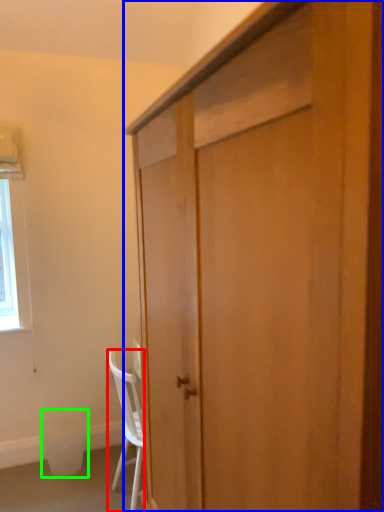
Question: Estimate the real-world distances between objects in this image. Which object is closer to chair (highlighted by a red box), cabinetry (highlighted by a blue box) or trash bin/can (highlighted by a green box)?

Choices:
 (A) cabinetry
 (B) trash bin/can

Answer: (B)